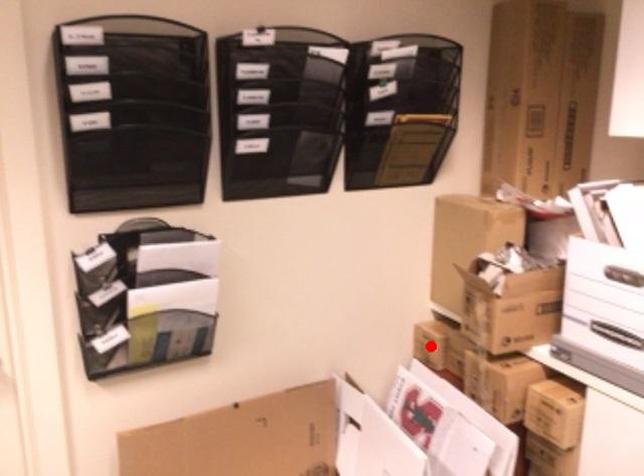
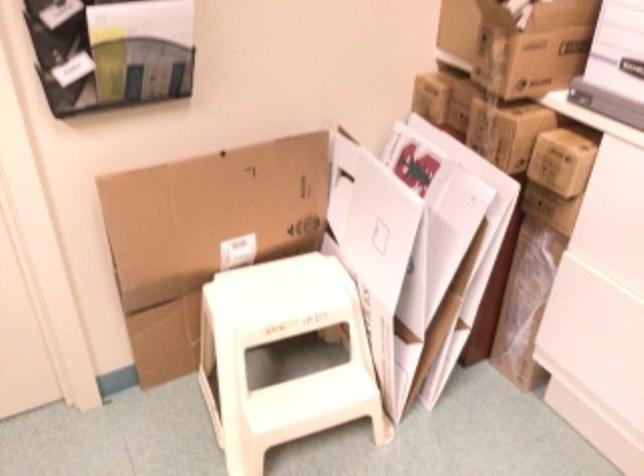
In the second image, find the point that corresponds to the highlighted location in the first image.

(431, 96)